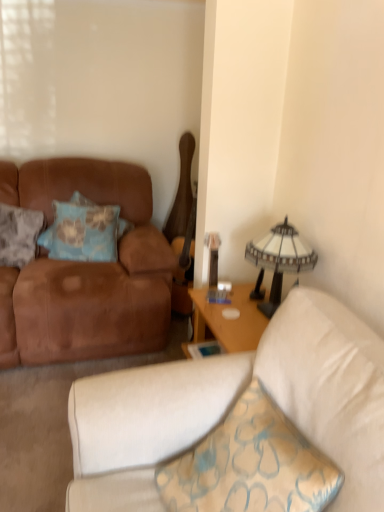
Question: Is brown suede couch at left, acting as the 2th studio couch starting from the front, shorter than suede brown couch at left, the second studio couch positioned from the back?

Choices:
 (A) yes
 (B) no

Answer: (B)

Question: Considering the relative positions of brown suede couch at left, the 1th studio couch when ordered from back to front, and suede brown couch at left, the 1th studio couch viewed from the front, in the image provided, is brown suede couch at left, the 1th studio couch when ordered from back to front, to the left of suede brown couch at left, the 1th studio couch viewed from the front, from the viewer's perspective?

Choices:
 (A) no
 (B) yes

Answer: (B)

Question: Considering the relative sizes of brown suede couch at left, the 1th studio couch when ordered from back to front, and suede brown couch at left, the 1th studio couch viewed from the front, in the image provided, is brown suede couch at left, the 1th studio couch when ordered from back to front, smaller than suede brown couch at left, the 1th studio couch viewed from the front,?

Choices:
 (A) no
 (B) yes

Answer: (A)

Question: From a real-world perspective, does brown suede couch at left, acting as the 2th studio couch starting from the front, sit lower than suede brown couch at left, the 1th studio couch viewed from the front?

Choices:
 (A) no
 (B) yes

Answer: (B)

Question: Does brown suede couch at left, the 1th studio couch when ordered from back to front, have a lesser width compared to suede brown couch at left, the 1th studio couch viewed from the front?

Choices:
 (A) yes
 (B) no

Answer: (B)

Question: Is brown suede couch at left, the 1th studio couch when ordered from back to front, not close to suede brown couch at left, the 1th studio couch viewed from the front?

Choices:
 (A) yes
 (B) no

Answer: (A)

Question: Is white glass lampshade at upper right facing towards textured blue pillow at left, positioned as the first pillow in left-to-right order?

Choices:
 (A) no
 (B) yes

Answer: (A)

Question: Is white glass lampshade at upper right closer to the viewer compared to textured blue pillow at left, the 2th pillow when ordered from right to left?

Choices:
 (A) yes
 (B) no

Answer: (A)

Question: Would you say white glass lampshade at upper right is outside textured blue pillow at left, positioned as the first pillow in left-to-right order?

Choices:
 (A) yes
 (B) no

Answer: (A)

Question: Considering the relative sizes of white glass lampshade at upper right and textured blue pillow at left, positioned as the first pillow in left-to-right order, in the image provided, is white glass lampshade at upper right shorter than textured blue pillow at left, positioned as the first pillow in left-to-right order,?

Choices:
 (A) no
 (B) yes

Answer: (B)

Question: Is textured blue pillow at left, positioned as the first pillow in left-to-right order, inside white glass lampshade at upper right?

Choices:
 (A) no
 (B) yes

Answer: (A)

Question: Can you confirm if white glass lampshade at upper right is positioned to the right of textured blue pillow at left, positioned as the first pillow in left-to-right order?

Choices:
 (A) yes
 (B) no

Answer: (A)

Question: Can you confirm if blue fabric pillow at left, arranged as the 1th pillow when viewed from the right, is positioned to the right of textured blue pillow at left, the 2th pillow when ordered from right to left?

Choices:
 (A) no
 (B) yes

Answer: (B)